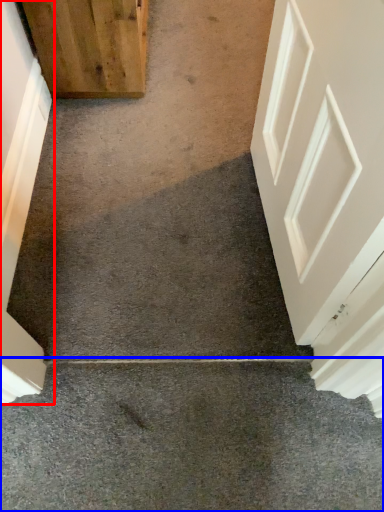
Question: Which point is further to the camera, door (highlighted by a red box) or concrete (highlighted by a blue box)?

Choices:
 (A) door
 (B) concrete

Answer: (A)